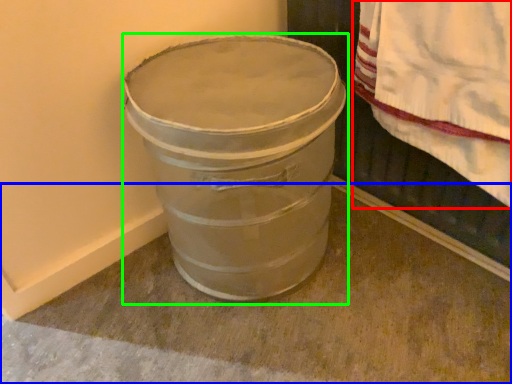
Question: Which object is positioned closest to blanket (highlighted by a red box)? Select from concrete (highlighted by a blue box) and waste container (highlighted by a green box).

Choices:
 (A) concrete
 (B) waste container

Answer: (B)